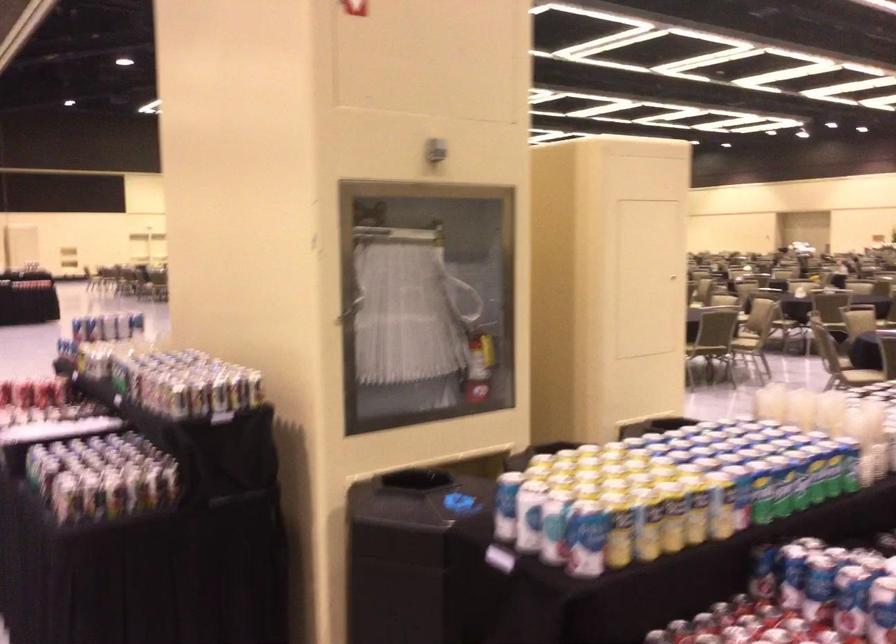
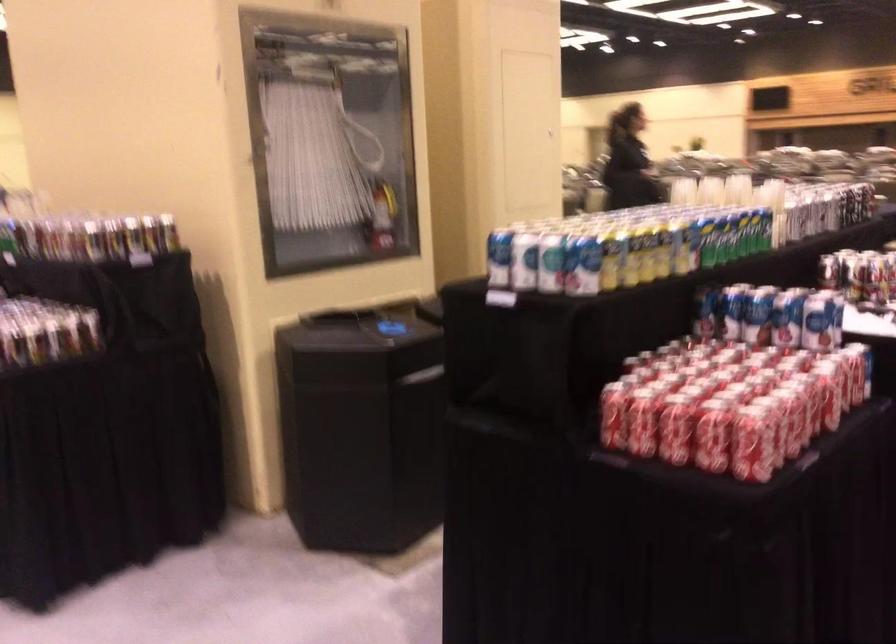
The point at (764,408) is marked in the first image. Where is the corresponding point in the second image?

(683, 190)